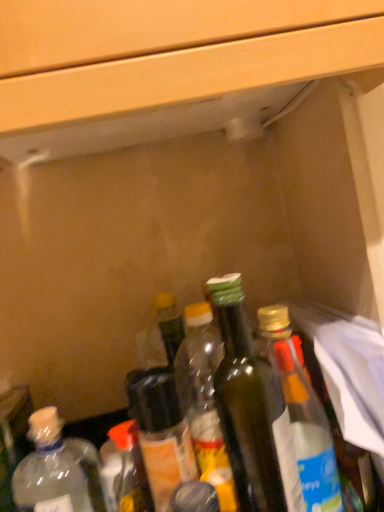
Question: From a real-world perspective, is green glass bottle at center, which is the 2th bottle in right-to-left order, positioned above or below translucent plastic bottle at center, the fourth bottle positioned from the right?

Choices:
 (A) below
 (B) above

Answer: (B)

Question: Considering the positions of green glass bottle at center, which is the fifth bottle in left-to-right order, and translucent plastic bottle at center, the fourth bottle positioned from the right, in the image, is green glass bottle at center, which is the fifth bottle in left-to-right order, wider or thinner than translucent plastic bottle at center, the fourth bottle positioned from the right,?

Choices:
 (A) thin
 (B) wide

Answer: (A)

Question: Which is farther from the green glass bottle at center, which is the 2th bottle in right-to-left order?

Choices:
 (A) translucent plastic bottle at lower left, arranged as the 5th bottle when viewed from the right
 (B) clear glass bottle at center, the sixth bottle in the left-to-right sequence
 (C) clear plastic bottle at lower left, the 6th bottle in the right-to-left sequence
 (D) translucent plastic bottle at center, the fourth bottle positioned from the right
 (E) green glass bottle at center, which is the fourth bottle from left to right

Answer: (C)

Question: Which of these objects is positioned farthest from the clear glass bottle at center, placed as the first bottle when sorted from right to left?

Choices:
 (A) green glass bottle at center, which is the 2th bottle in right-to-left order
 (B) clear plastic bottle at lower left, the 6th bottle in the right-to-left sequence
 (C) translucent plastic bottle at lower left, arranged as the 5th bottle when viewed from the right
 (D) green glass bottle at center, which is the fourth bottle from left to right
 (E) translucent plastic bottle at center, the fourth bottle positioned from the right

Answer: (B)